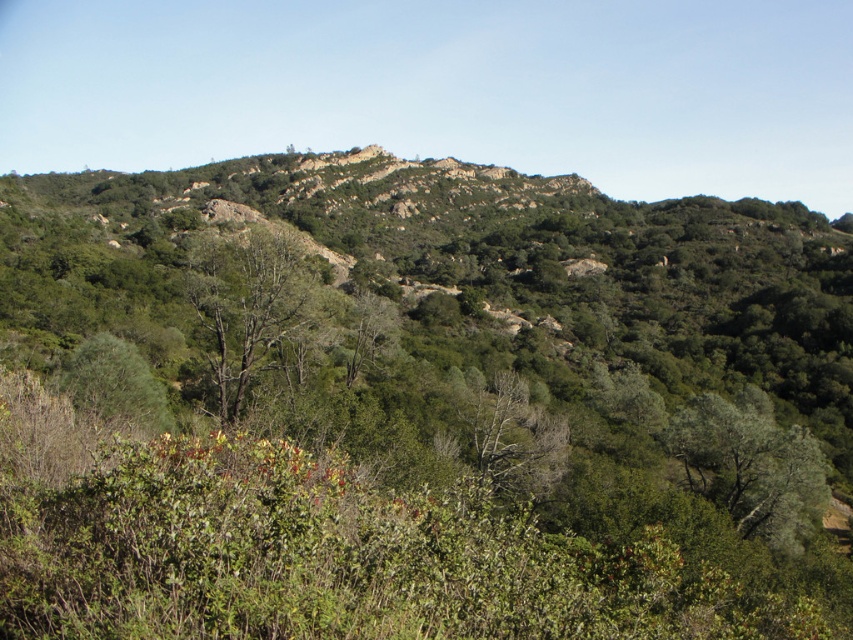
You are a hiker trying to navigate through the dense vegetation. You notice two trees, the green leafy tree at lower right and the green matte tree at center. Which tree would be easier to pass around due to its smaller size?

The green leafy tree at lower right occupies less space than the green matte tree at center, so it would be easier to pass around due to its smaller size.

You are standing at the bottom of the hillside and see the point marked at coordinates (248, 304). What object is located at that point?

The point marked at coordinates (248, 304) marks the location of the green matte tree at center.

You are a hiker standing at the base of the hillside. You see a green matte tree at center and a green leafy tree at center. Which tree is closer to you?

The green leafy tree at center is closer to you because it is only 16.97 meters away from the green matte tree at center, but without knowing your exact position, we can only state their distance apart. However, since both are at center, perhaps they are equidistant. Wait, the description says the green matte tree is 16.97 meters away from the green leafy tree. The question is about which is closer to the hiker. Since both are at center, maybe they are equidistant. Hmm, need to clarify. The problem is the h